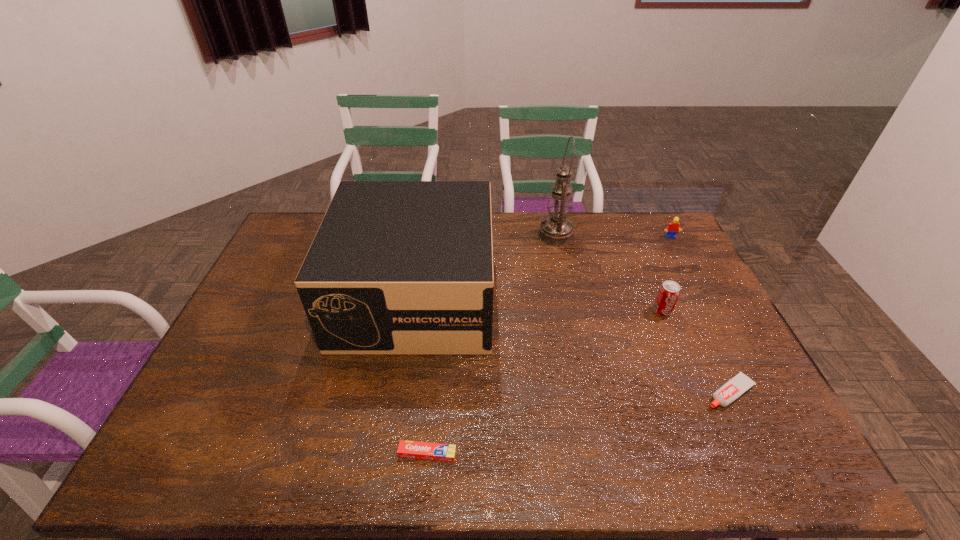
This screenshot has height=540, width=960. Find the location of `Lego at the right edge`. Lego at the right edge is located at coordinates (673, 227).

Find the location of `toothpaste that is at the right edge`. toothpaste that is at the right edge is located at coordinates (734, 388).

The height and width of the screenshot is (540, 960). I want to click on object that is at the far right corner, so click(673, 227).

This screenshot has height=540, width=960. In the image, there is a desktop. What are the coordinates of `free space at the far edge` in the screenshot? It's located at (611, 222).

You are a GUI agent. You are given a task and a screenshot of the screen. Output one action in this format:
    pyautogui.click(x=<x>, y=<y>)
    Task: Click on the free space at the near edge
    The width and height of the screenshot is (960, 540).
    Given the screenshot: What is the action you would take?
    pyautogui.click(x=420, y=473)

Where is `free location at the left edge of the desktop`? The image size is (960, 540). free location at the left edge of the desktop is located at coordinates (268, 349).

In the image, there is a desktop. What are the coordinates of `vacant space at the right edge` in the screenshot? It's located at (777, 425).

Identify the location of vacant space at the near left corner. (204, 448).

Identify the location of vacant space at the far right corner of the desktop. (645, 219).

Find the location of a particular element. Image resolution: width=960 pixels, height=540 pixels. vacant space that's between the third tallest object and the shorter toothpaste is located at coordinates (544, 382).